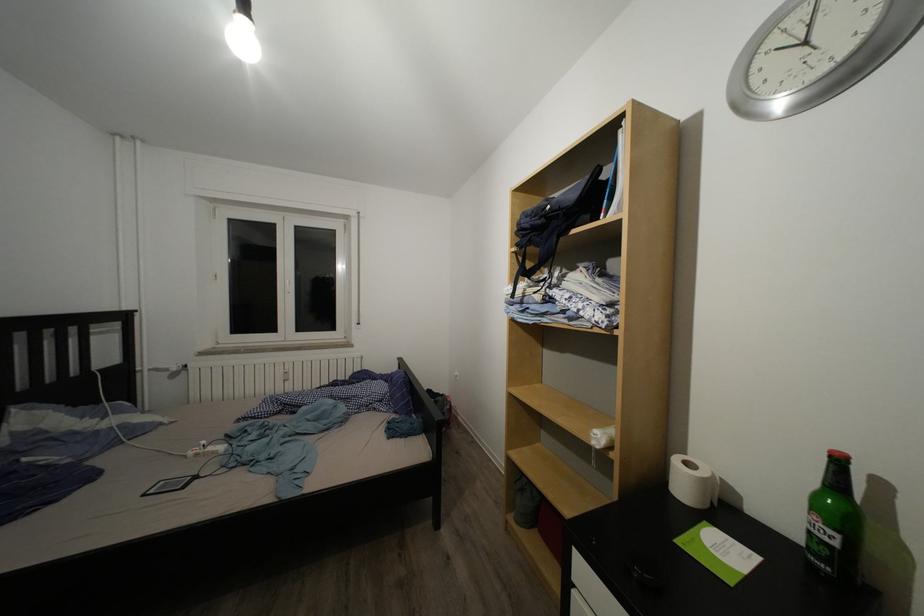
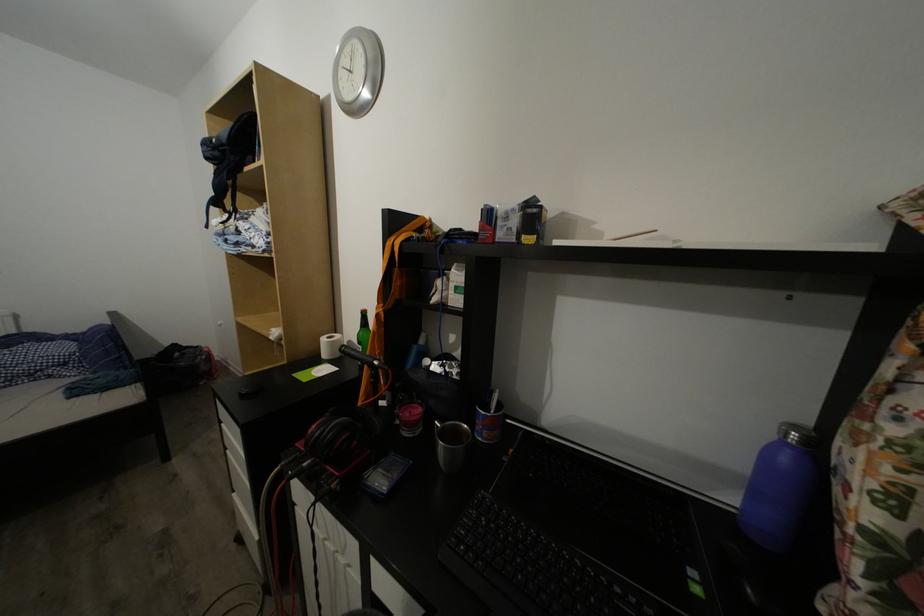
Question: The camera is either moving clockwise (left) or counter-clockwise (right) around the object. The first image is from the beginning of the video and the second image is from the end. Is the camera moving left or right when shooting the video?

Choices:
 (A) Left
 (B) Right

Answer: (A)